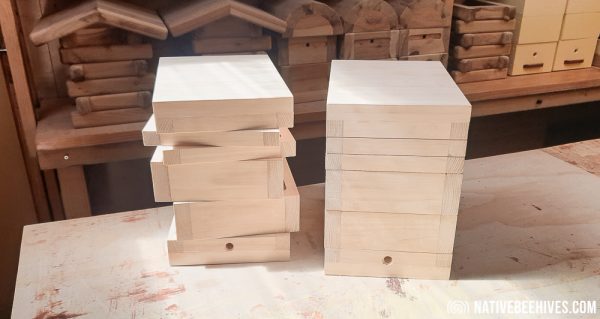
Locate an element on the screen. The image size is (600, 319). handles is located at coordinates (535, 63), (583, 61).